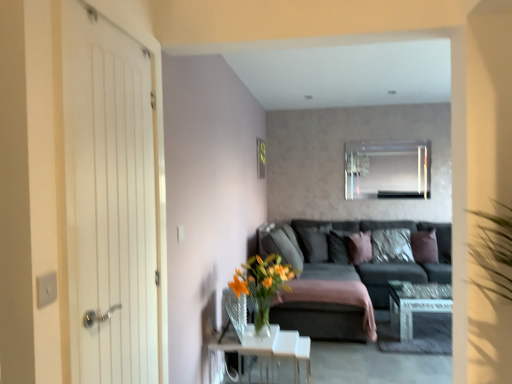
Question: Is clear glass table at lower center, which is the second table in back-to-front order, wider than dark gray fabric couch at center?

Choices:
 (A) yes
 (B) no

Answer: (B)

Question: Is clear glass table at lower center, positioned as the second table in right-to-left order, outside of dark gray fabric couch at center?

Choices:
 (A) yes
 (B) no

Answer: (A)

Question: Is clear glass table at lower center, marked as the 1th table in a left-to-right arrangement, to the left of dark gray fabric couch at center from the viewer's perspective?

Choices:
 (A) yes
 (B) no

Answer: (A)

Question: Is clear glass table at lower center, positioned as the second table in right-to-left order, aimed at dark gray fabric couch at center?

Choices:
 (A) no
 (B) yes

Answer: (A)

Question: Is clear glass table at lower center, positioned as the second table in right-to-left order, looking in the opposite direction of dark gray fabric couch at center?

Choices:
 (A) no
 (B) yes

Answer: (A)

Question: Is textured gray pillow at center, arranged as the fourth pillow when viewed from the left, inside or outside of brown velvet pillow at right, the 5th pillow from the left?

Choices:
 (A) outside
 (B) inside

Answer: (A)

Question: Is textured gray pillow at center, acting as the 2th pillow starting from the right, in front of or behind brown velvet pillow at right, the 5th pillow from the left, in the image?

Choices:
 (A) front
 (B) behind

Answer: (B)

Question: From a real-world perspective, is textured gray pillow at center, acting as the 2th pillow starting from the right, above or below brown velvet pillow at right, the 5th pillow from the left?

Choices:
 (A) below
 (B) above

Answer: (A)

Question: From their relative heights in the image, would you say textured gray pillow at center, acting as the 2th pillow starting from the right, is taller or shorter than brown velvet pillow at right, the 5th pillow from the left?

Choices:
 (A) tall
 (B) short

Answer: (A)

Question: Considering the relative positions of brown velvet pillow at right, the first pillow viewed from the right, and velvet brown pillow at center, the first pillow from the left, in the image provided, is brown velvet pillow at right, the first pillow viewed from the right, to the left or to the right of velvet brown pillow at center, the first pillow from the left,?

Choices:
 (A) left
 (B) right

Answer: (B)

Question: From the image's perspective, is brown velvet pillow at right, the first pillow viewed from the right, positioned above or below velvet brown pillow at center, the first pillow from the left?

Choices:
 (A) above
 (B) below

Answer: (B)

Question: Is brown velvet pillow at right, the 5th pillow from the left, wider or thinner than velvet brown pillow at center, which appears as the fifth pillow when viewed from the right?

Choices:
 (A) wide
 (B) thin

Answer: (B)

Question: Is brown velvet pillow at right, the 5th pillow from the left, in front of or behind velvet brown pillow at center, the first pillow from the left, in the image?

Choices:
 (A) behind
 (B) front

Answer: (B)

Question: From the image's perspective, is orange glass vase at center located above or below clear glass mirror at upper center?

Choices:
 (A) above
 (B) below

Answer: (B)

Question: Would you say orange glass vase at center is to the left or to the right of clear glass mirror at upper center in the picture?

Choices:
 (A) left
 (B) right

Answer: (A)